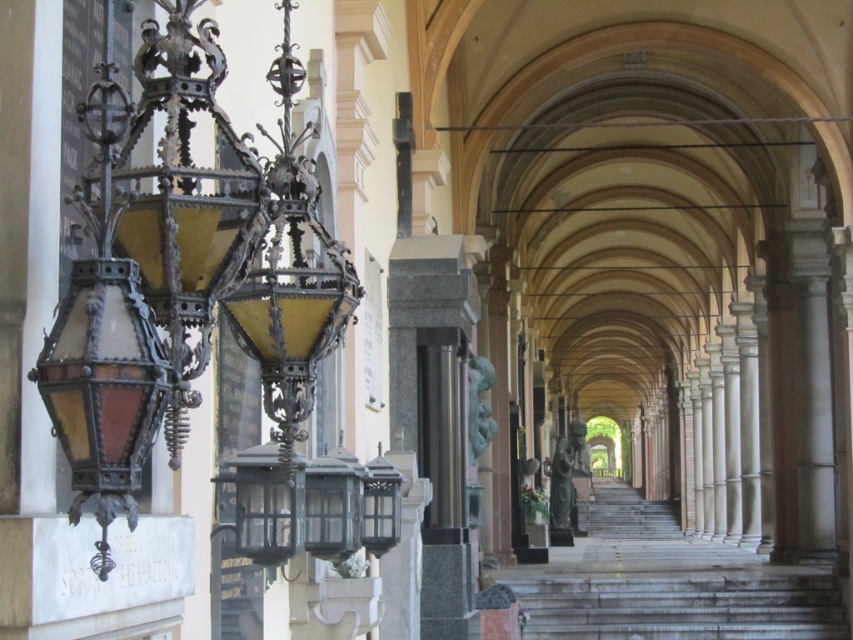
Question: Which point is farther to the camera?

Choices:
 (A) bronze statue at center
 (B) white marble stairs at lower center

Answer: (A)

Question: Is white marble stairs at lower center to the right of bronze statue at center from the viewer's perspective?

Choices:
 (A) yes
 (B) no

Answer: (A)

Question: Which point appears farthest from the camera in this image?

Choices:
 (A) (821, 634)
 (B) (563, 436)

Answer: (B)

Question: Which of the following is the closest to the observer?

Choices:
 (A) (537, 634)
 (B) (566, 513)

Answer: (A)

Question: Does white marble stairs at lower center have a lesser width compared to bronze statue at center?

Choices:
 (A) no
 (B) yes

Answer: (A)

Question: Does white marble stairs at lower center lie in front of bronze statue at center?

Choices:
 (A) yes
 (B) no

Answer: (A)